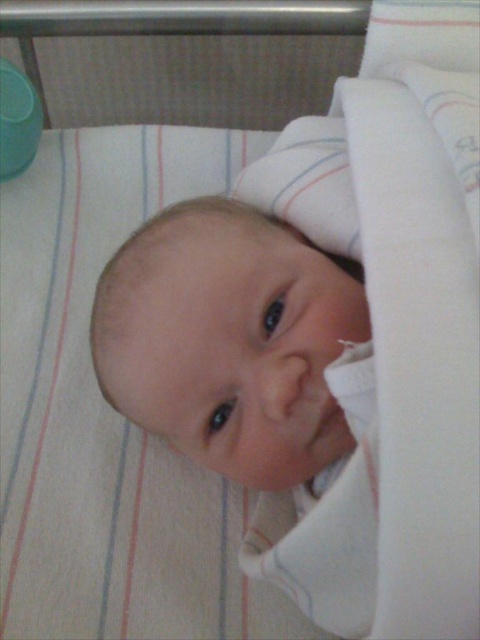
You are a healthcare professional observing the baby in the crib. Based on the baby lying on its back with head tilted to the side, where is the smooth skin baby at center positioned relative to the crib frame and the green object?

The smooth skin baby at center is positioned near the center of the crib, slightly offset towards the right side since the coordinates are close to the center but the green object is on the left. The baby is lying on its back with its head tilted to one side, facing the camera.

Imagine you are looking at the image and see two points marked in the scene. The first point is at coordinates point (181, 428) and the second point is at point (267, 410). Which point is closer to the camera?

Point (267, 410) is closer to the camera because the Objects Description states that point (181, 428) is behind point (267, 410).

You are a photographer taking a closeup shot of the baby. You notice the smooth skin baby at center and the smooth flesh nose at center. Which object is closer to the camera?

The smooth flesh nose at center is behind the smooth skin baby at center, so the smooth skin baby at center is closer to the camera.